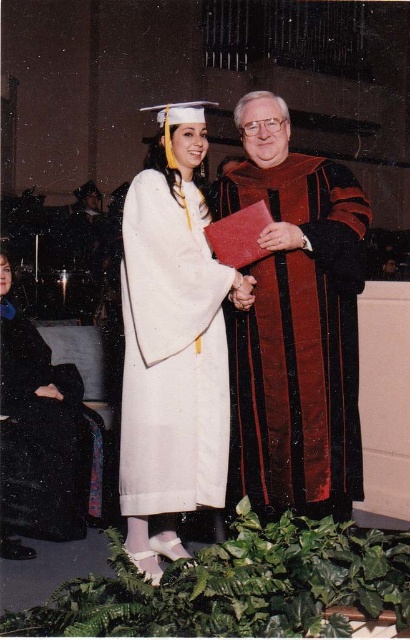
Does white matte graduation gown at center appear on the left side of black matte robe at lower left?

No, white matte graduation gown at center is not to the left of black matte robe at lower left.

In the scene shown: Does white matte graduation gown at center have a larger size compared to black matte robe at lower left?

Yes.

Locate an element on the screen. The image size is (410, 640). white matte graduation gown at center is located at coordinates (173, 344).

Which is above, velvet maroon gown at center or black matte robe at lower left?

velvet maroon gown at center is higher up.

Can you confirm if velvet maroon gown at center is wider than black matte robe at lower left?

Yes.

The width and height of the screenshot is (410, 640). What do you see at coordinates (295, 324) in the screenshot?
I see `velvet maroon gown at center` at bounding box center [295, 324].

You are a GUI agent. You are given a task and a screenshot of the screen. Output one action in this format:
    pyautogui.click(x=<x>, y=<y>)
    Task: Click on the velvet maroon gown at center
    The image size is (410, 640).
    Given the screenshot: What is the action you would take?
    pyautogui.click(x=295, y=324)

Between velvet maroon gown at center and white matte graduation gown at center, which one has more height?

white matte graduation gown at center

Is velvet maroon gown at center taller than white matte graduation gown at center?

No.

Image resolution: width=410 pixels, height=640 pixels. What do you see at coordinates (295, 324) in the screenshot? I see `velvet maroon gown at center` at bounding box center [295, 324].

Locate an element on the screen. This screenshot has height=640, width=410. velvet maroon gown at center is located at coordinates (295, 324).